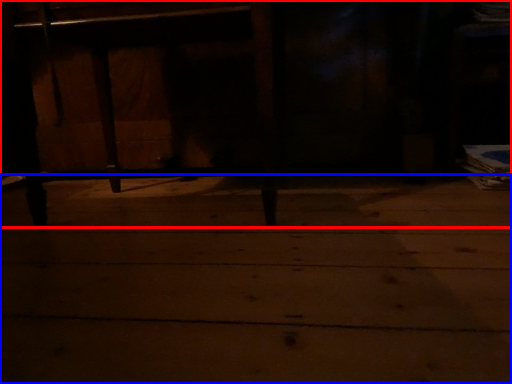
Question: Among these objects, which one is farthest to the camera, furniture (highlighted by a red box) or concrete (highlighted by a blue box)?

Choices:
 (A) furniture
 (B) concrete

Answer: (A)